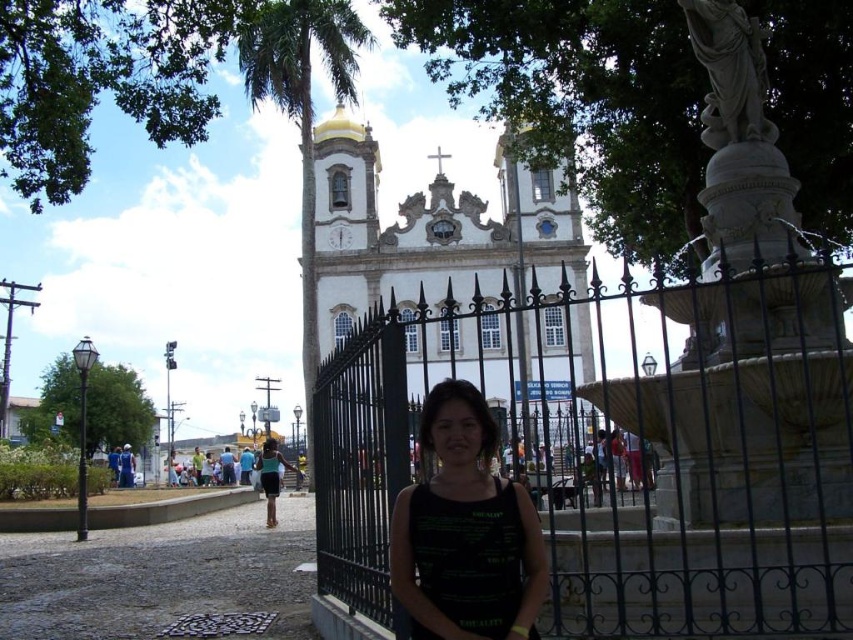
You are standing in the outdoor scene and want to take a photo of the black matte tank top at center. Considering the distance, will you need a telephoto lens to capture it clearly?

The black matte tank top at center is 93.67 meters away from the viewer. Since this distance is quite far, using a telephoto lens would help to capture it clearly by magnifying the subject from afar.

You are standing at the point with coordinates (x=625, y=449) in the image. What object are you directly facing?

The point at coordinates (x=625, y=449) indicates the black wrought iron fence at center, so you are directly facing the black wrought iron fence at center.

Based on the photo, you are standing at the point represented by point (465, 531). What object are you standing on?

You are standing on the black matte tank top at center.